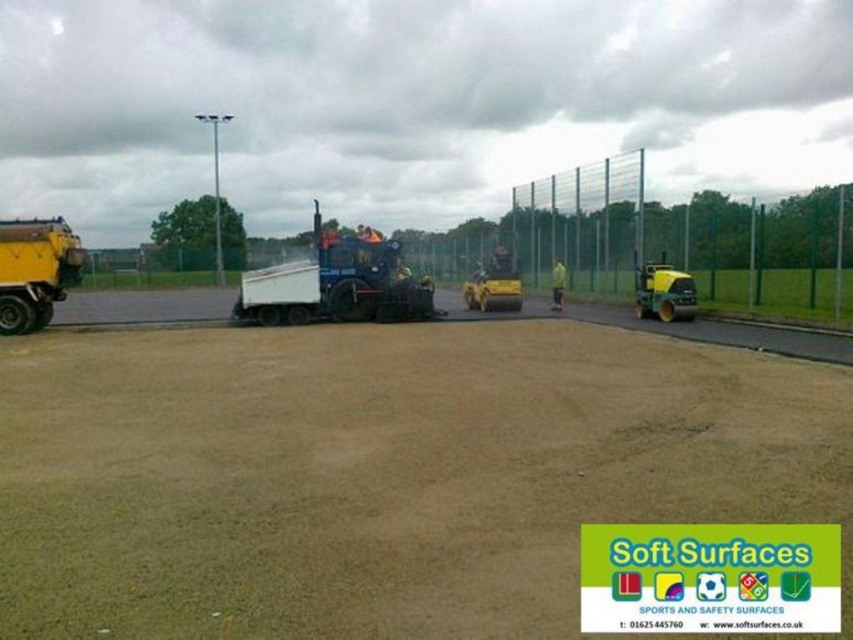
Consider the image. You are a construction inspector standing at the point marked by the coordinates point (335,284). What object are you standing on?

The point (335,284) marks the blue rubberized asphalt spreader at center, so you are standing on the blue rubberized asphalt spreader at center.

You are a construction worker who needs to drive the yellow rubber truck at left to deliver materials to the construction site. However, there is a brown sandy dirt track at center blocking your path. Can you drive around it without going off the designated path?

The brown sandy dirt track at center is in front of the yellow rubber truck at left, meaning it is blocking the truck from moving forward. To avoid going off the designated path, the worker should maneuver the truck around the track by either moving to the side or taking an alternative route that bypasses the track.